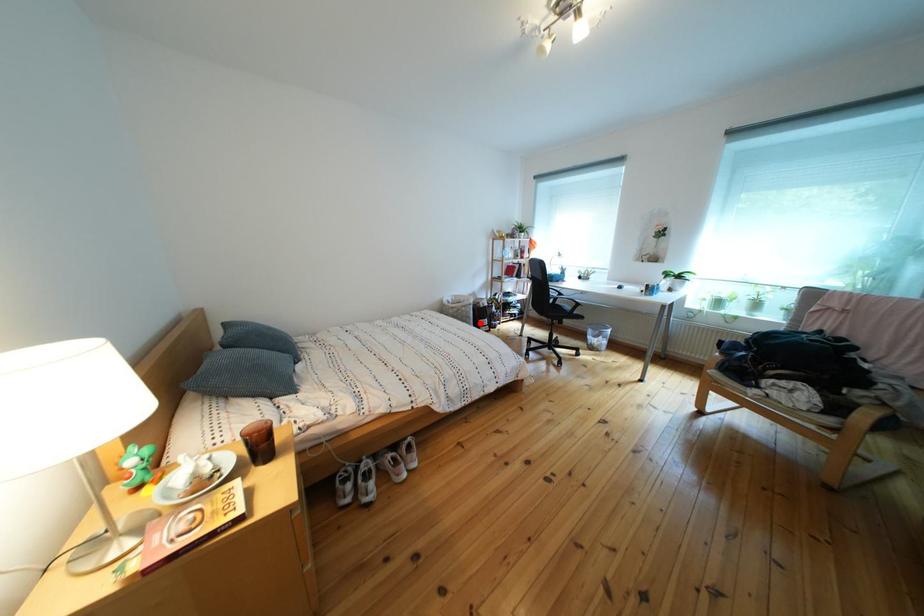
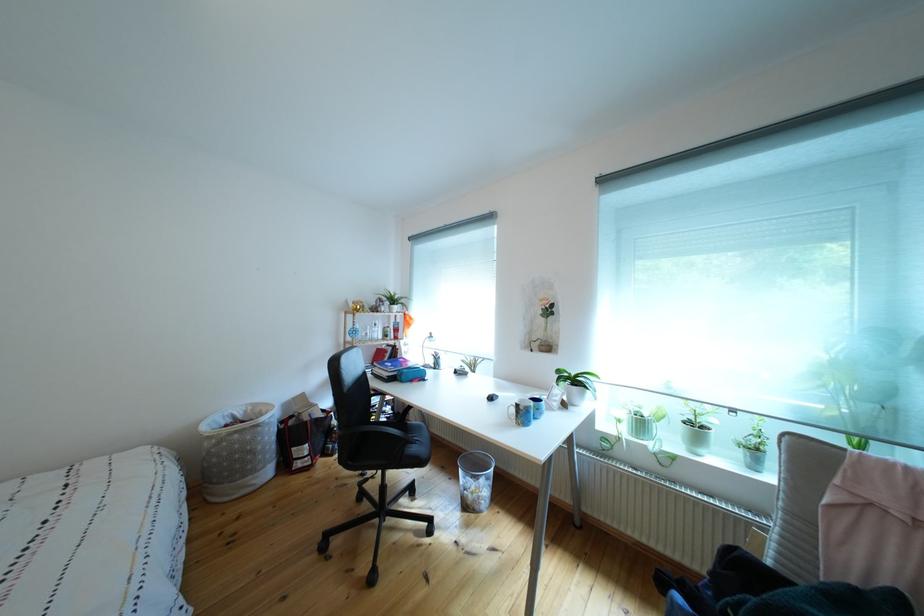
Locate, in the second image, the point that corresponds to the highlighted location in the first image.

(263, 456)